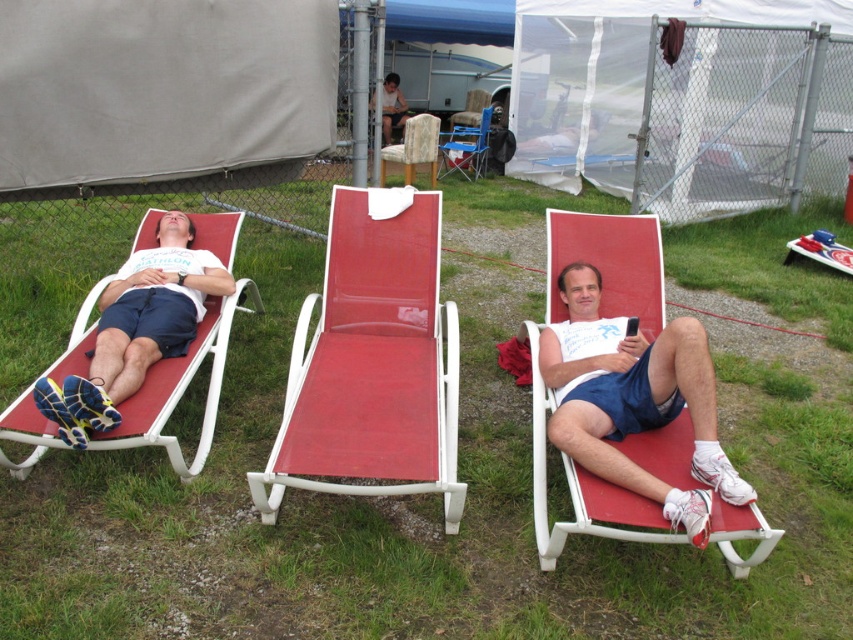
You are planning to bring a third person to join the two people in the scene. There are two chairs available. Which chair, the matte red lounge chair at left or the wooden textured chair at center, can accommodate a taller person more comfortably?

The matte red lounge chair at left has a larger size compared to the wooden textured chair at center, so it can accommodate a taller person more comfortably.

You are standing in the grassy area where the two red reclining chairs are placed. You notice two points marked in the scene. Which point is closer to your position, point (793, 531) or point (618, 472)?

Point (793, 531) is closer to your position because it is further to the viewer than point (618, 472).